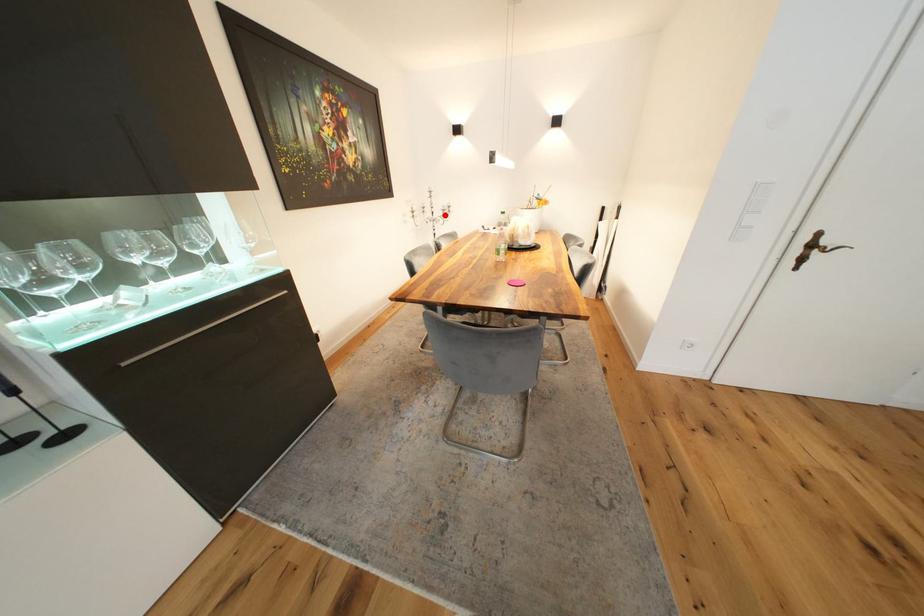
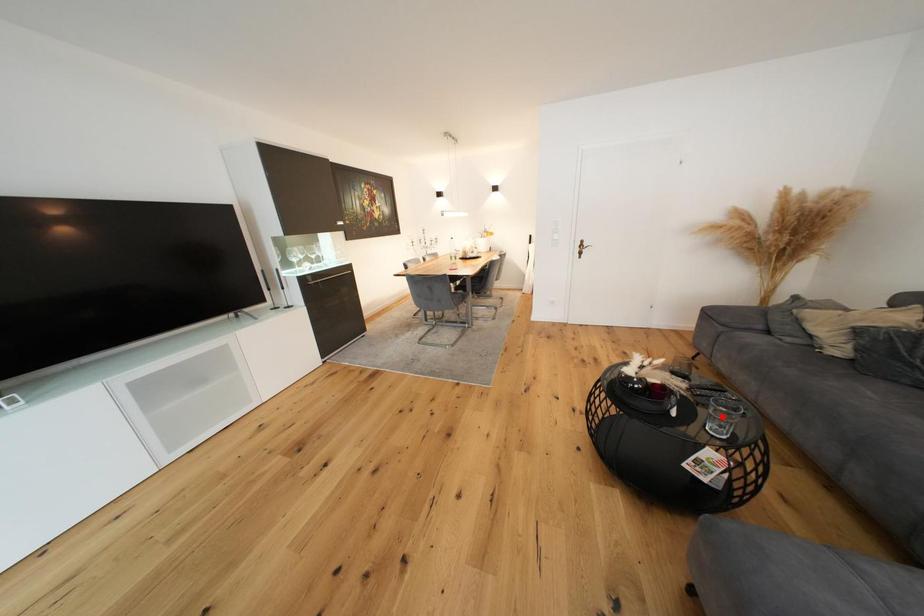
I am providing you with two images of the same scene from different viewpoints. A red point is marked on the first image and another point is marked on the second image. Is the marked point in image1 the same physical position as the marked point in image2?

No